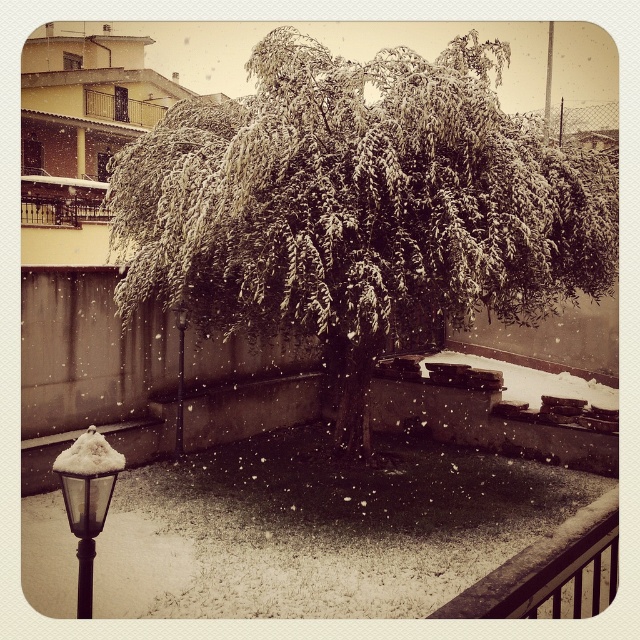
Question: Is snow-covered leaves at center positioned in front of matte black lamp post at lower left?

Choices:
 (A) no
 (B) yes

Answer: (A)

Question: Estimate the real-world distances between objects in this image. Which object is farther from the matte black lamp post at lower left?

Choices:
 (A) snow-covered leaves at center
 (B) white fluffy snow at lower left

Answer: (A)

Question: Is snow-covered leaves at center to the right of white fluffy snow at lower left from the viewer's perspective?

Choices:
 (A) yes
 (B) no

Answer: (A)

Question: Which point is farther to the camera?

Choices:
 (A) (349, 346)
 (B) (93, 467)
 (C) (100, 435)

Answer: (A)

Question: Which is farther from the matte black lamp post at lower left?

Choices:
 (A) snow-covered leaves at center
 (B) white fluffy snow at lower left

Answer: (A)

Question: Is the position of snow-covered leaves at center less distant than that of white fluffy snow at lower left?

Choices:
 (A) no
 (B) yes

Answer: (A)